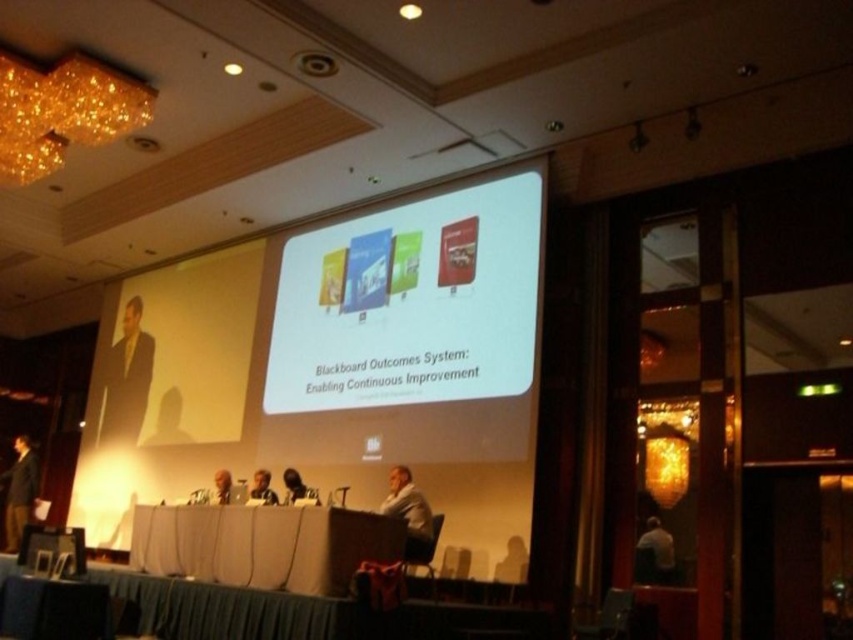
You are standing at the entrance of the conference room and want to walk directly to the white fabric table at center. What are the coordinates you need to aim for?

You should aim for the coordinates point at (263, 545) to reach the white fabric table at center.

You are setting up a camera to capture the conference. The camera is placed at the back of the room. To ensure the white glossy projection screen at center is in focus, where should you aim the camera?

The white glossy projection screen at center is located at point (410, 304), so you should aim the camera at that coordinate to ensure it is in focus.